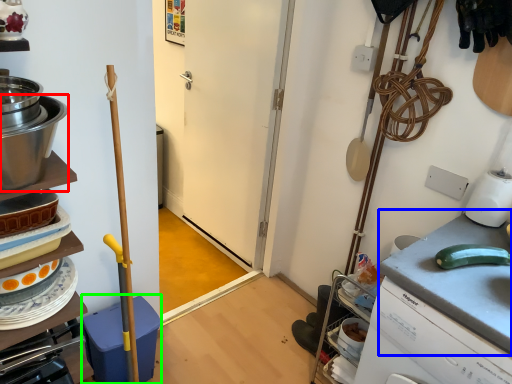
Question: Which is nearer to the kitchen appliance (highlighted by a red box)? counter top (highlighted by a blue box) or dish washer (highlighted by a green box).

Choices:
 (A) counter top
 (B) dish washer

Answer: (B)